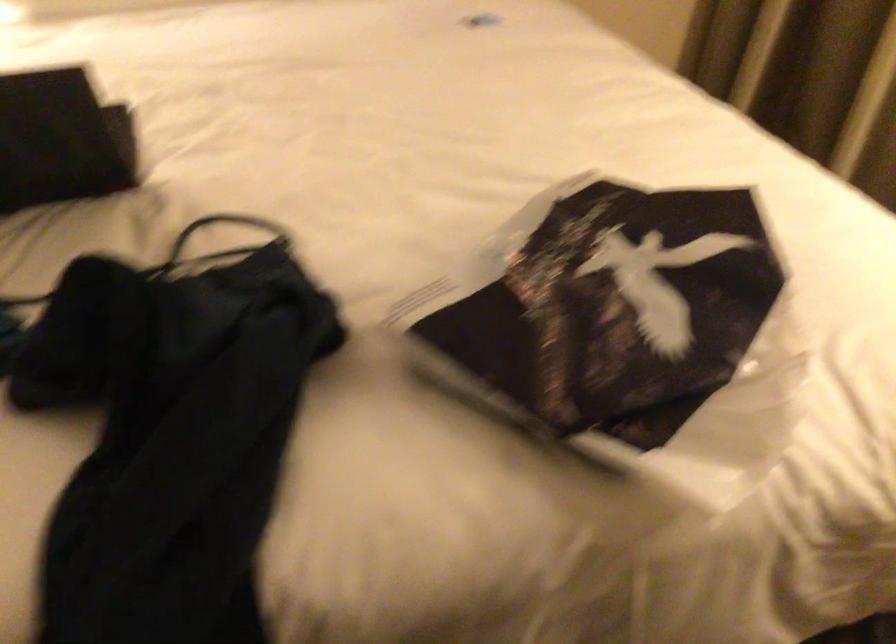
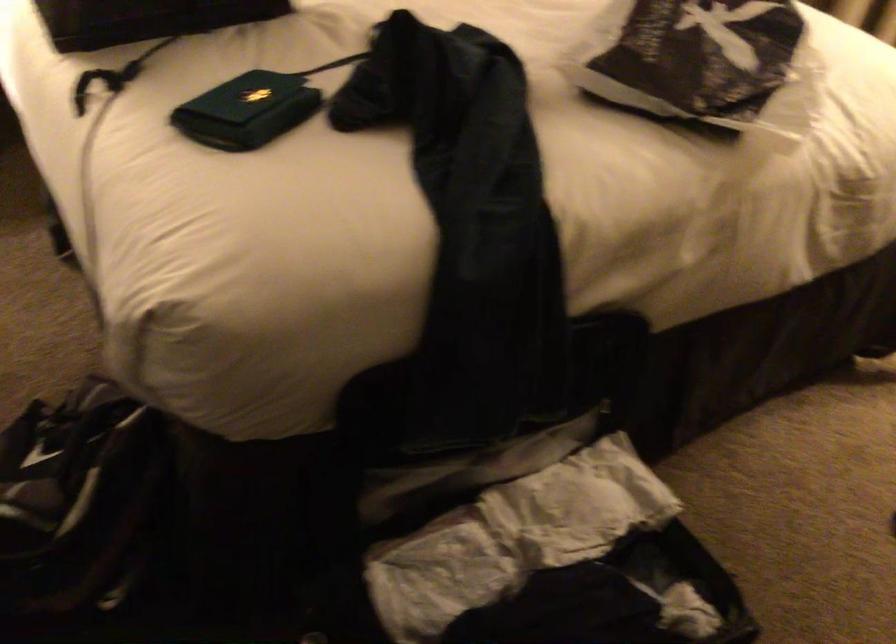
In a continuous first-person perspective shot, in which direction is the camera moving?

The cameraman walked toward left, backward.